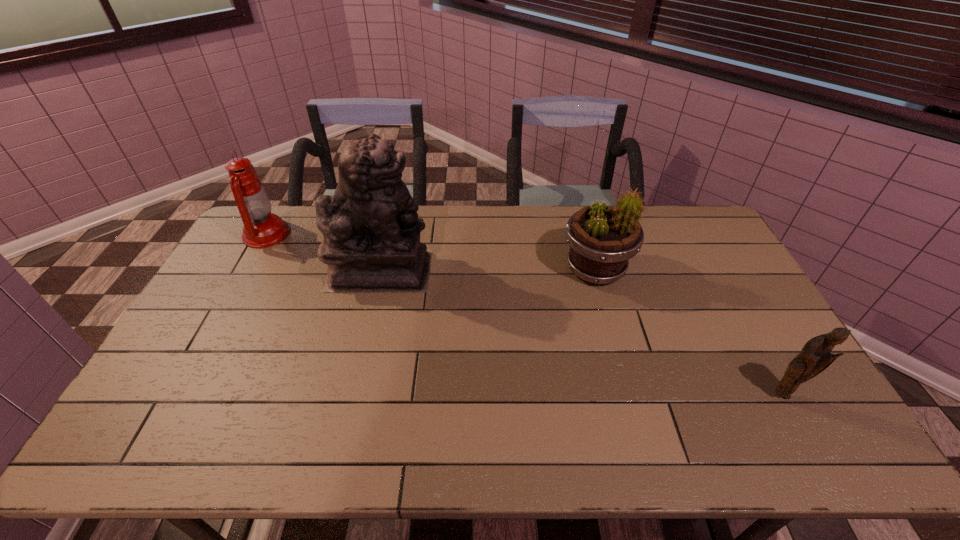
Locate an element on the screen. Image resolution: width=960 pixels, height=540 pixels. free spot between the nearest object and the leftmost object is located at coordinates (524, 314).

Identify the location of free point between the tallest object and the nearest object. The height and width of the screenshot is (540, 960). (581, 332).

Locate an element on the screen. This screenshot has width=960, height=540. unoccupied area between the rightmost object and the sculpture is located at coordinates (581, 332).

You are a GUI agent. You are given a task and a screenshot of the screen. Output one action in this format:
    pyautogui.click(x=<x>, y=<y>)
    Task: Click on the free space between the oil lamp and the nearest object
    The width and height of the screenshot is (960, 540).
    Given the screenshot: What is the action you would take?
    coord(524,314)

This screenshot has height=540, width=960. In order to click on free space between the flowerpot and the shortest object in this screenshot , I will do `click(688, 332)`.

I want to click on unoccupied area between the sculpture and the third object from left to right, so click(x=488, y=269).

Find the location of a particular element. This screenshot has width=960, height=540. vacant space that's between the third object from right to left and the third object from left to right is located at coordinates (488, 269).

Locate an element on the screen. The height and width of the screenshot is (540, 960). free spot between the nearest object and the leftmost object is located at coordinates (524, 314).

Identify which object is the third closest to the shortest object. Please provide its 2D coordinates. Your answer should be formatted as a tuple, i.e. [(x, y)], where the tuple contains the x and y coordinates of a point satisfying the conditions above.

[(262, 229)]

Identify which object is the nearest to the third object from right to left. Please provide its 2D coordinates. Your answer should be formatted as a tuple, i.e. [(x, y)], where the tuple contains the x and y coordinates of a point satisfying the conditions above.

[(262, 229)]